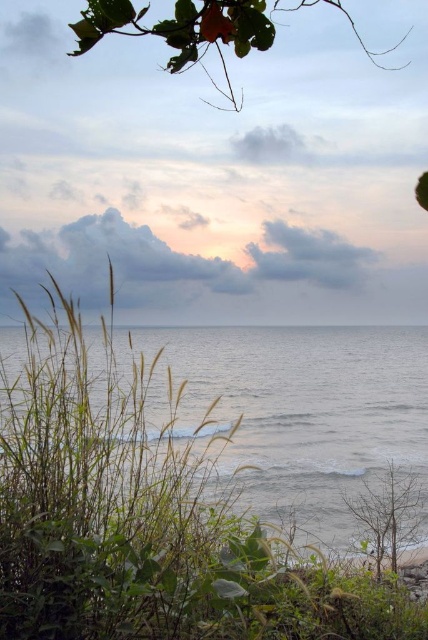
From the picture: You are standing on the beach and see the gray matte water at center and the green leafy branch at upper center. Which object is closer to the horizon?

The gray matte water at center is closer to the horizon because it is located below the green leafy branch at upper center, which is positioned higher up in the scene.

You are standing at the point closer to the viewer between the two points, point (368,380) and point (261,4). If you want to walk towards the horizon, which direction should you face?

You should face towards the horizon in the direction away from the point closer to you, which is point (368,380). Since point (368,380) is closer to you than point (261,4), walking towards the horizon would mean facing away from point (368,380) and towards the opposite direction of the point further away, point (261,4).

You are standing at the origin point in the scene. Which direction should you move to reach the gray matte water at center?

The gray matte water at center is located at point [299,412], so you should move towards the northeast direction to reach it.